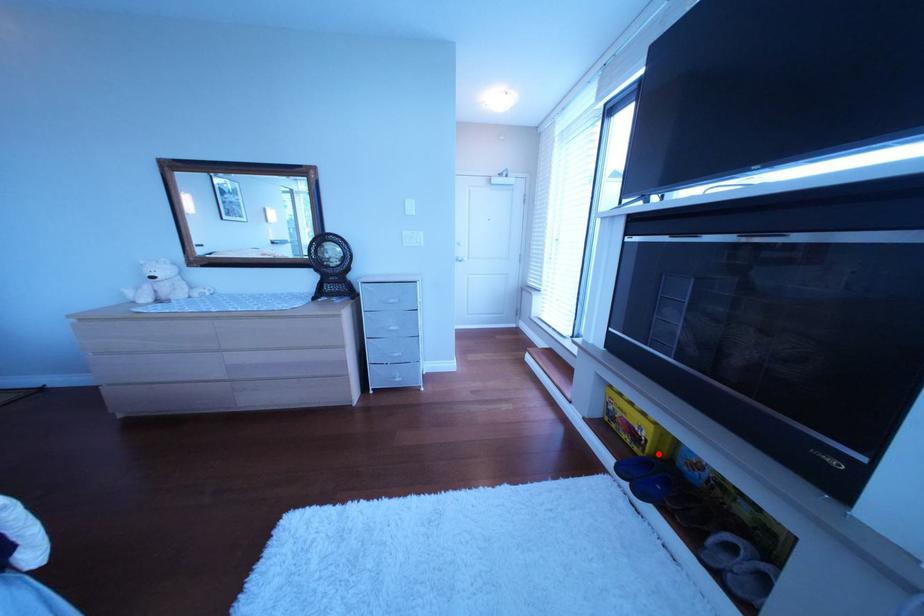
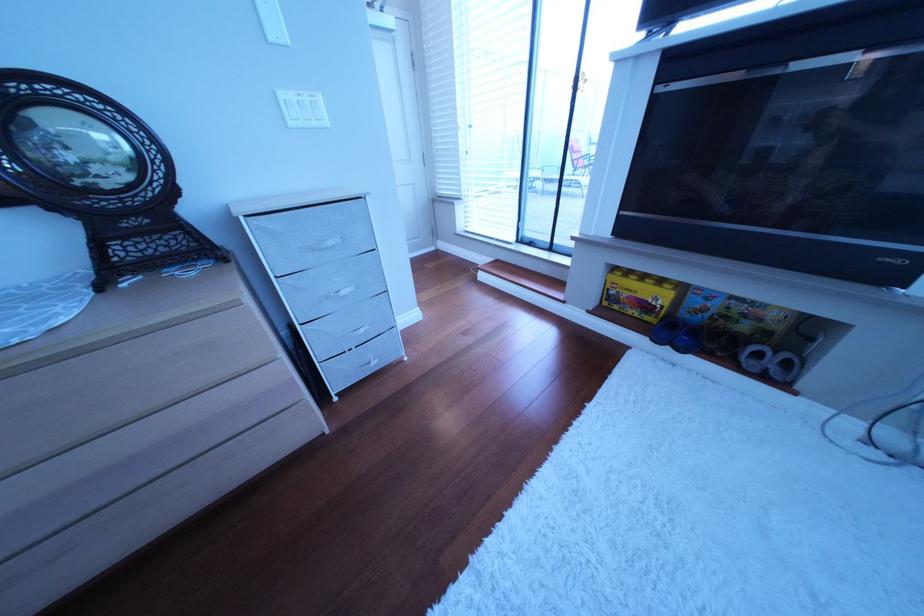
The point at the highlighted location is marked in the first image. Where is the corresponding point in the second image?

(672, 320)